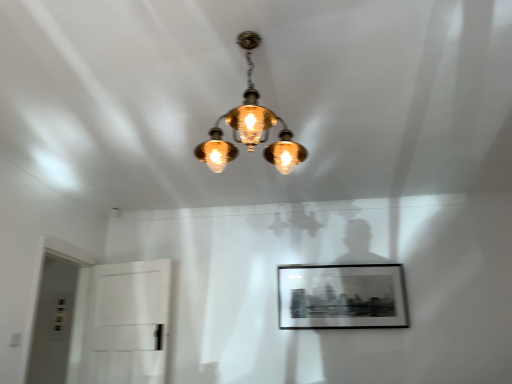
Question: Does point (90, 342) appear closer or farther from the camera than point (41, 291)?

Choices:
 (A) farther
 (B) closer

Answer: (B)

Question: Would you say white glossy door at left, which ranks as the first glass door in right-to-left order, is to the left or to the right of transparent glass door at lower left, placed as the 2th glass door when sorted from right to left, in the picture?

Choices:
 (A) left
 (B) right

Answer: (B)

Question: Considering the real-world distances, which object is farthest from the matte brass chandelier at center?

Choices:
 (A) black matte picture frame at center
 (B) white glossy door at left, which ranks as the first glass door in right-to-left order
 (C) transparent glass door at lower left, placed as the 2th glass door when sorted from right to left

Answer: (C)

Question: Estimate the real-world distances between objects in this image. Which object is farther from the white glossy door at left, which appears as the second glass door when viewed from the left?

Choices:
 (A) matte brass chandelier at center
 (B) black matte picture frame at center
 (C) transparent glass door at lower left, placed as the 2th glass door when sorted from right to left

Answer: (A)